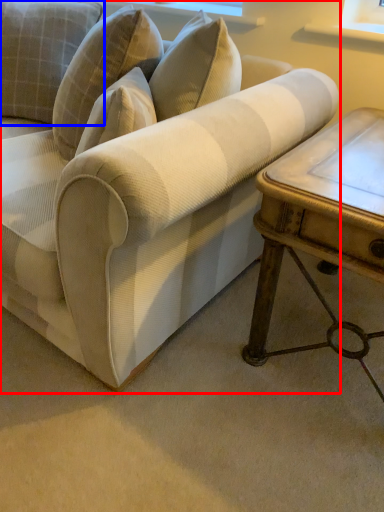
Question: Which object is closer to the camera taking this photo, studio couch (highlighted by a red box) or pillow (highlighted by a blue box)?

Choices:
 (A) studio couch
 (B) pillow

Answer: (A)